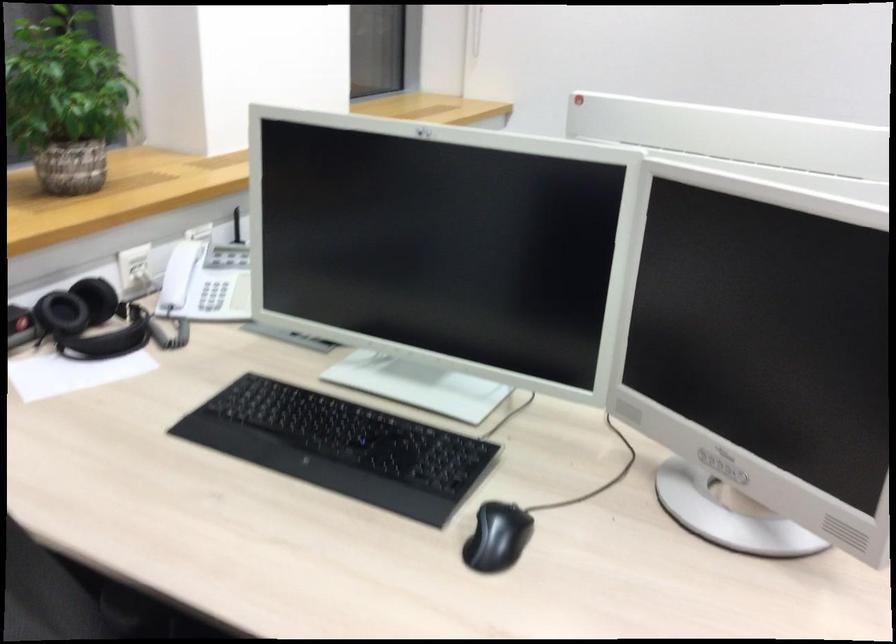
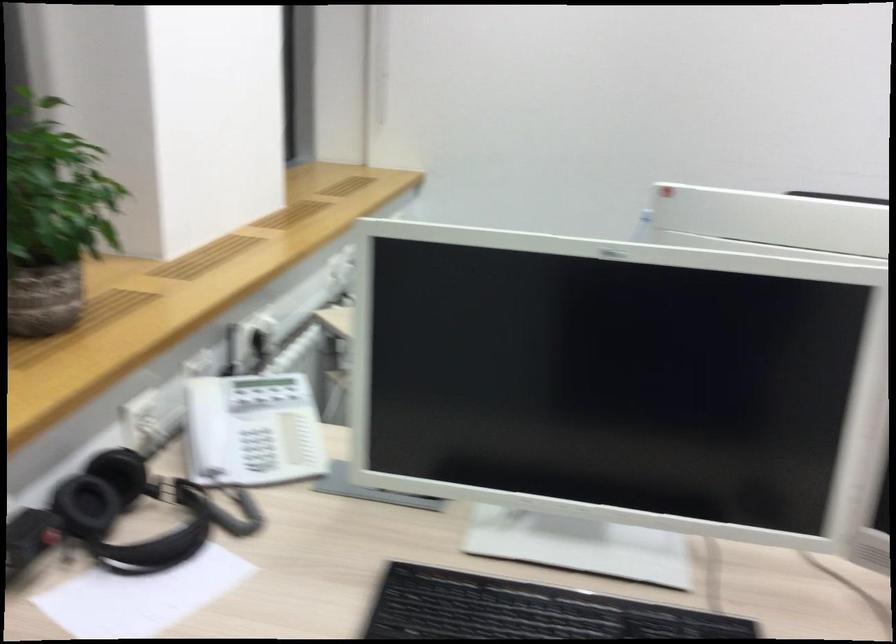
Question: The camera is either moving clockwise (left) or counter-clockwise (right) around the object. The first image is from the beginning of the video and the second image is from the end. Is the camera moving left or right when shooting the video?

Choices:
 (A) Left
 (B) Right

Answer: (A)